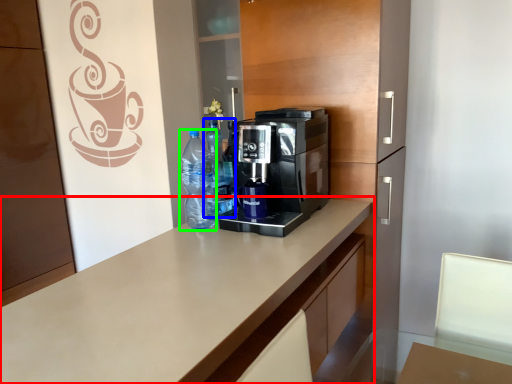
Question: Considering the real-world distances, which object is farthest from countertop (highlighted by a red box)? bottle (highlighted by a blue box) or bottle (highlighted by a green box)?

Choices:
 (A) bottle
 (B) bottle

Answer: (A)